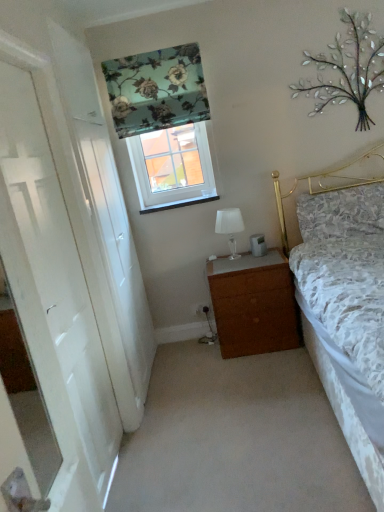
At what (x,y) coordinates should I click in order to perform the action: click on vacant area that lies to the right of white glossy door at left. Please return your answer as a coordinate pair (x, y). The width and height of the screenshot is (384, 512). Looking at the image, I should click on [191, 365].